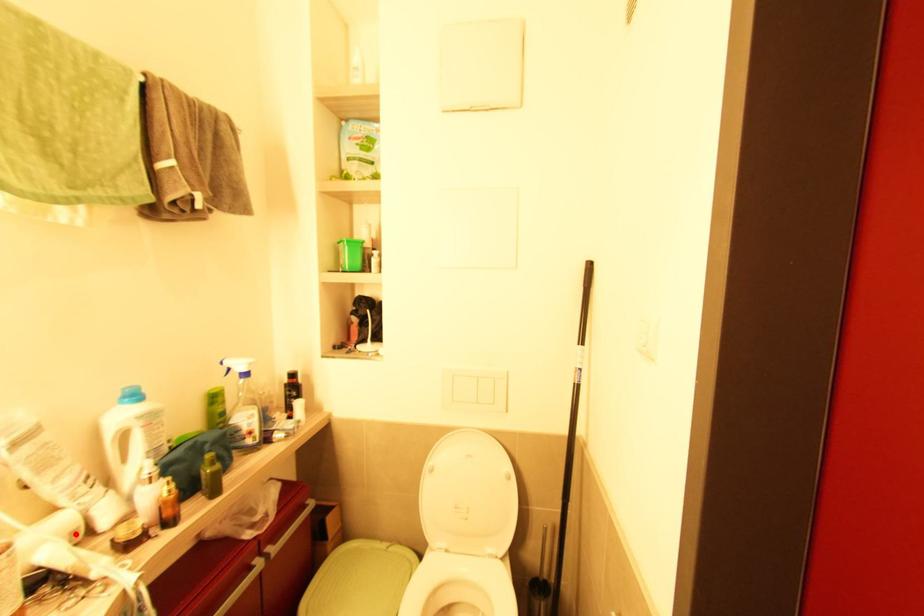
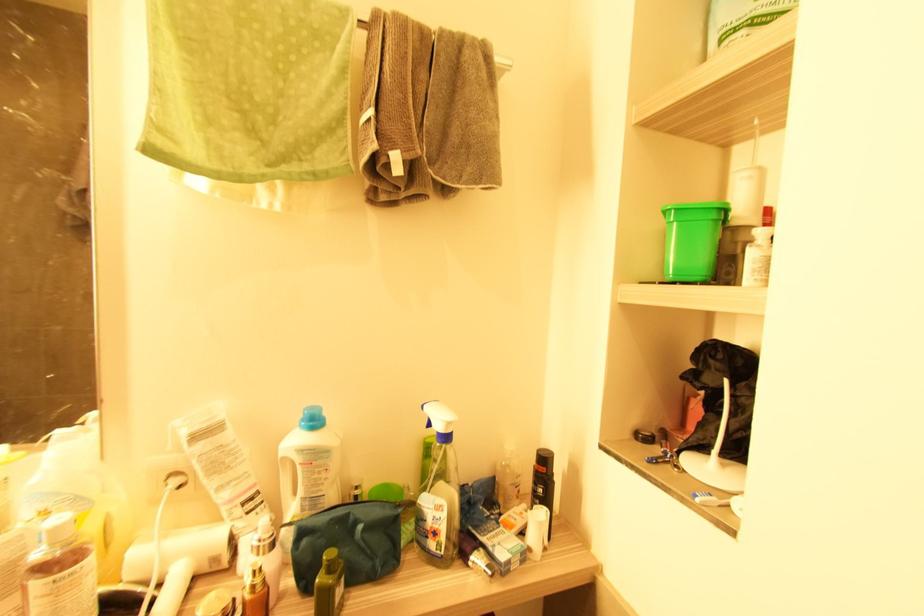
In the second image, find the point that corresponds to the highlighted location in the first image.

(216, 561)